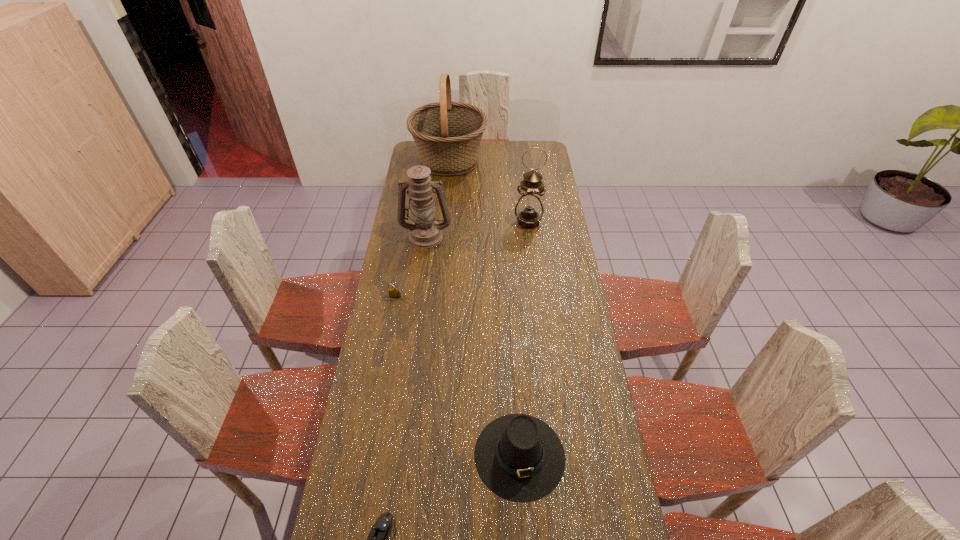
This screenshot has width=960, height=540. I want to click on basket, so (x=447, y=134).

The image size is (960, 540). Identify the location of the right oil lamp. (529, 210).

Identify the location of the left oil lamp. The image size is (960, 540). (425, 232).

This screenshot has width=960, height=540. In order to click on the second nearest object in this screenshot , I will do `click(518, 457)`.

Where is `hat`? hat is located at coordinates (518, 457).

This screenshot has width=960, height=540. What are the coordinates of `the fifth tallest object` in the screenshot? It's located at (394, 292).

Locate an element on the screen. This screenshot has width=960, height=540. padlock is located at coordinates (394, 292).

This screenshot has height=540, width=960. I want to click on vacant space located on the right of the farthest object, so 528,160.

Find the location of a particular element. vacant space located 0.050m on the right of the right oil lamp is located at coordinates (553, 222).

Find the location of a particular element. Image resolution: width=960 pixels, height=540 pixels. free space located 0.190m on the front of the left oil lamp is located at coordinates (420, 279).